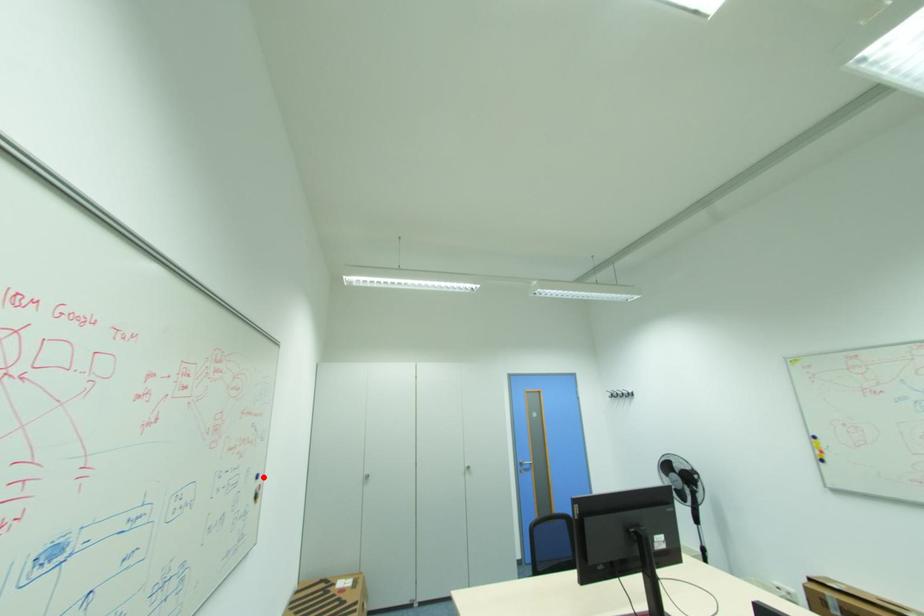
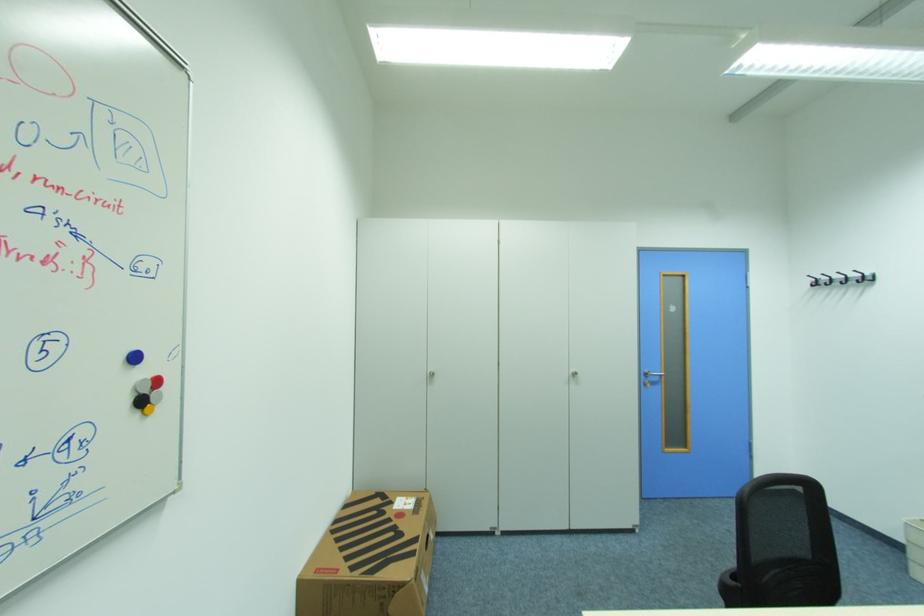
Question: I am providing you with two images of the same scene from different viewpoints. A red point is marked on the first image. Is the red point's position out of view in image 2?

Choices:
 (A) Yes
 (B) No

Answer: (B)